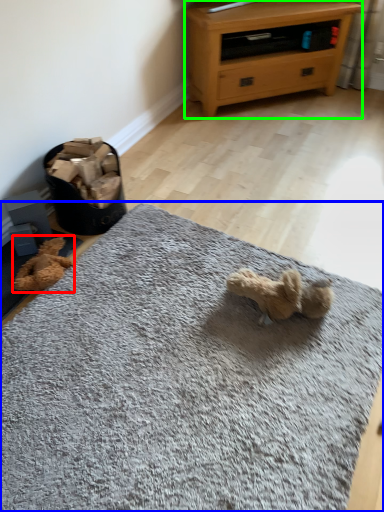
Question: Estimate the real-world distances between objects in this image. Which object is farther from teddy (highlighted by a red box), mat (highlighted by a blue box) or chest of drawers (highlighted by a green box)?

Choices:
 (A) mat
 (B) chest of drawers

Answer: (B)